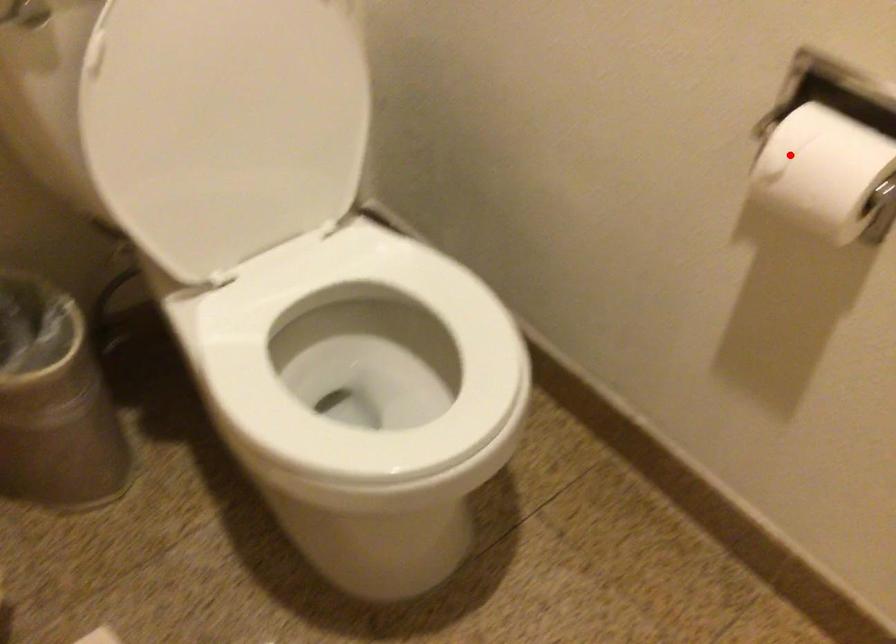
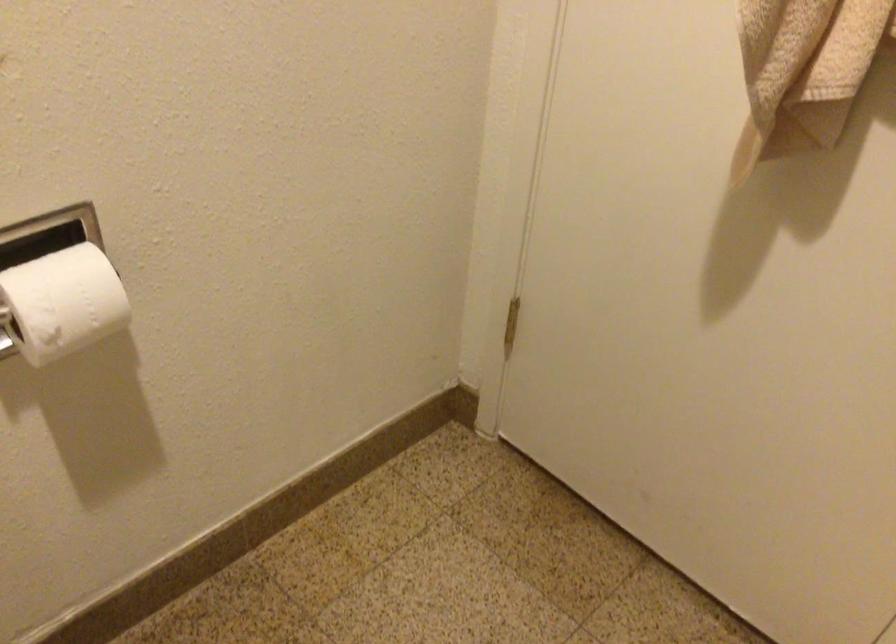
Find the pixel in the second image that matches the highlighted location in the first image.

(62, 303)